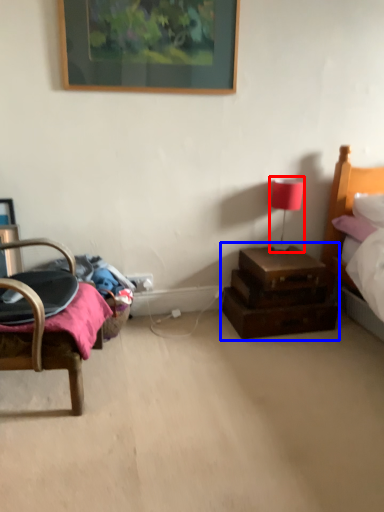
Question: Among these objects, which one is nearest to the camera, table lamp (highlighted by a red box) or nightstand (highlighted by a blue box)?

Choices:
 (A) table lamp
 (B) nightstand

Answer: (B)